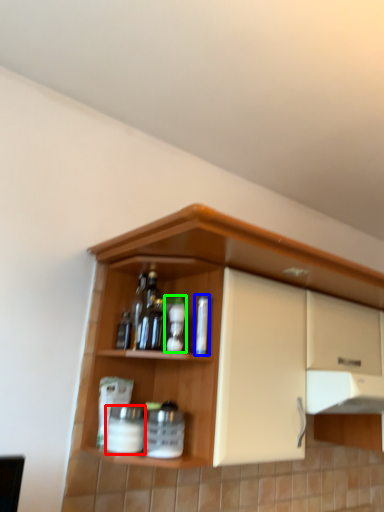
Question: Which object is the farthest from beverage (highlighted by a red box)? Choose among these: bottle (highlighted by a blue box) or bottle (highlighted by a green box).

Choices:
 (A) bottle
 (B) bottle

Answer: (A)